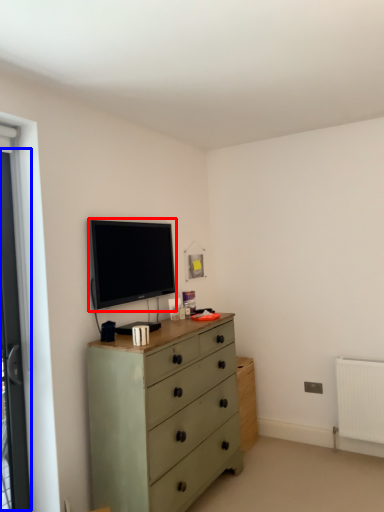
Question: Which point is closer to the camera, television (highlighted by a red box) or screen door (highlighted by a blue box)?

Choices:
 (A) television
 (B) screen door

Answer: (B)